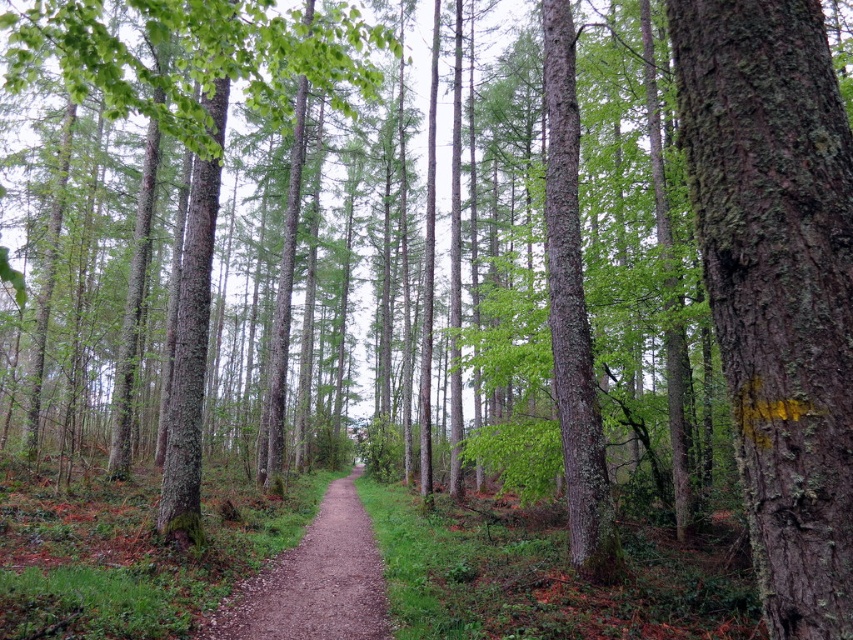
Consider the image. Is smooth bark tree at center positioned behind brown gravel path at center?

That is False.

Does point (201, 51) lie in front of point (364, 541)?

Yes, point (201, 51) is closer to viewer.

Locate an element on the screen. The width and height of the screenshot is (853, 640). smooth bark tree at center is located at coordinates [x=190, y=132].

Does green mossy bark tree at right have a lesser width compared to brown gravel path at center?

Indeed, green mossy bark tree at right has a lesser width compared to brown gravel path at center.

Who is more forward, (824,468) or (347,609)?

Point (824,468) is more forward.

Image resolution: width=853 pixels, height=640 pixels. I want to click on green mossy bark tree at right, so click(x=776, y=284).

Between green mossy bark tree at right and smooth bark tree at center, which one is positioned higher?

smooth bark tree at center is higher up.

Who is taller, green mossy bark tree at right or smooth bark tree at center?

smooth bark tree at center is taller.

The width and height of the screenshot is (853, 640). What do you see at coordinates (776, 284) in the screenshot?
I see `green mossy bark tree at right` at bounding box center [776, 284].

Locate an element on the screen. green mossy bark tree at right is located at coordinates (776, 284).